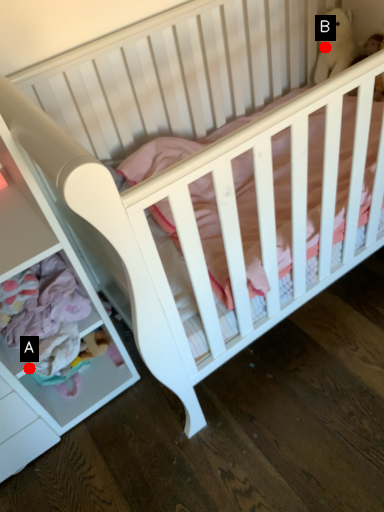
Question: Two points are circled on the image, labeled by A and B beside each circle. Which point is closer to the camera taking this photo?

Choices:
 (A) A is closer
 (B) B is closer

Answer: (A)